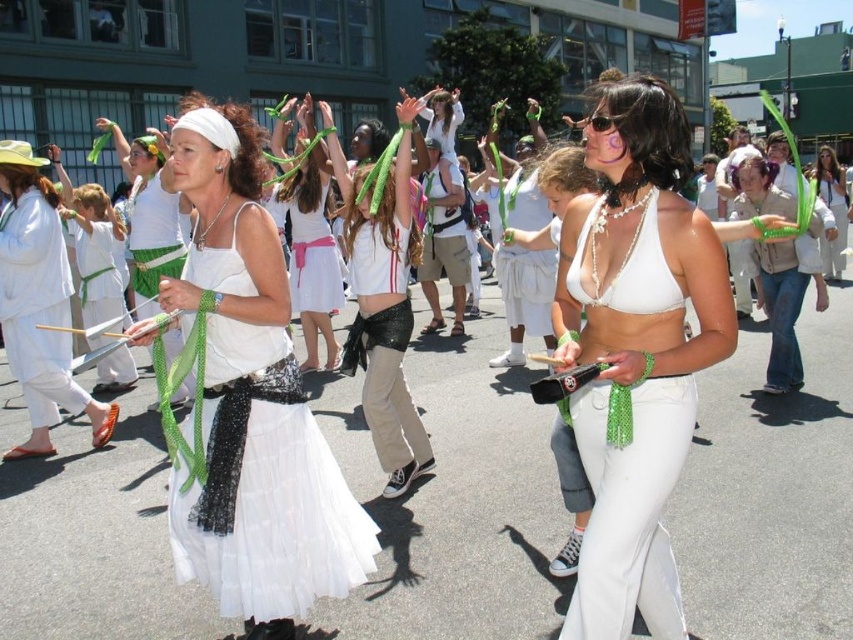
Is white tulle skirt at center thinner than white sequined skirt at center?

In fact, white tulle skirt at center might be wider than white sequined skirt at center.

Who is lower down, white tulle skirt at center or white sequined skirt at center?

Positioned lower is white tulle skirt at center.

The image size is (853, 640). In order to click on white tulle skirt at center in this screenshot , I will do `click(264, 486)`.

At what (x,y) coordinates should I click in order to perform the action: click on white tulle skirt at center. Please return your answer as a coordinate pair (x, y). Image resolution: width=853 pixels, height=640 pixels. Looking at the image, I should click on (264, 486).

In the scene shown: Is white matte bikini top at center behind pearl white bikini top at center?

That is False.

Which is above, white matte bikini top at center or pearl white bikini top at center?

pearl white bikini top at center is above.

Where is `white matte bikini top at center`? The height and width of the screenshot is (640, 853). white matte bikini top at center is located at coordinates (635, 352).

Which is behind, point (265, 522) or point (833, 273)?

Point (833, 273)

Does white tulle skirt at center lie in front of white fabric skirt at center?

Yes, white tulle skirt at center is closer to the viewer.

Find the location of a particular element. The height and width of the screenshot is (640, 853). white tulle skirt at center is located at coordinates (264, 486).

Locate an element on the screen. The height and width of the screenshot is (640, 853). white tulle skirt at center is located at coordinates (264, 486).